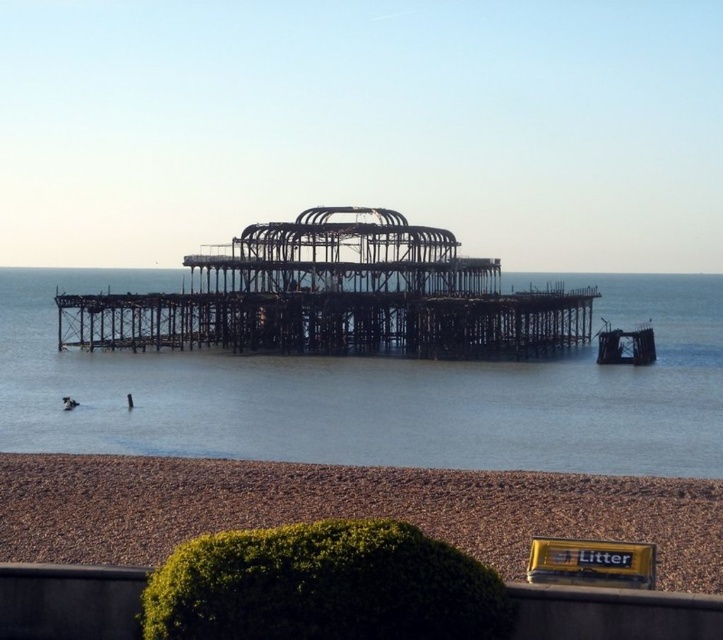
Is brown gravel at lower center shorter than dark skin human at lower left?

No.

Which is more to the left, brown gravel at lower center or dark skin human at lower left?

dark skin human at lower left is more to the left.

Is point (239, 497) farther from camera compared to point (127, 400)?

No, (239, 497) is in front of (127, 400).

Find the location of a particular element. brown gravel at lower center is located at coordinates (346, 508).

Who is taller, rusty metal pier at center or dark skin human at lower left?

Standing taller between the two is rusty metal pier at center.

Is point (363, 211) closer to camera compared to point (129, 394)?

No, (363, 211) is behind (129, 394).

What are the coordinates of `rusty metal pier at center` in the screenshot? It's located at (335, 298).

Image resolution: width=723 pixels, height=640 pixels. Identify the location of rusty metal pier at center. (335, 298).

Locate an element on the screen. Image resolution: width=723 pixels, height=640 pixels. rusty metal pier at center is located at coordinates 335,298.

How much distance is there between rusty metal pier at center and dark blue fabric at lower left?

They are 31.33 meters apart.

Who is more distant from viewer, (x=375, y=241) or (x=77, y=403)?

The point (x=375, y=241) is behind.

You are a GUI agent. You are given a task and a screenshot of the screen. Output one action in this format:
    pyautogui.click(x=<x>, y=<y>)
    Task: Click on the rusty metal pier at center
    The width and height of the screenshot is (723, 640).
    Given the screenshot: What is the action you would take?
    pyautogui.click(x=335, y=298)